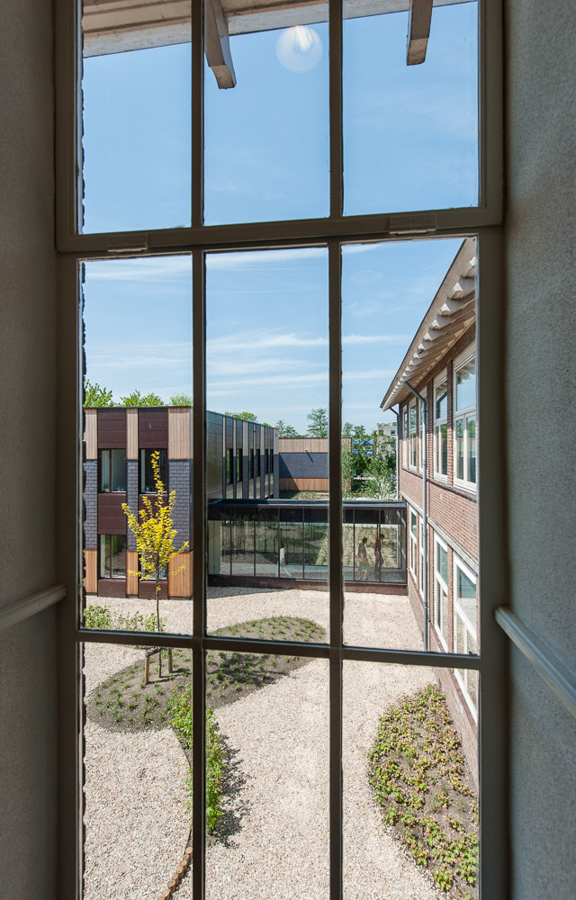
Where is `window frames`? window frames is located at coordinates (192, 644), (341, 651).